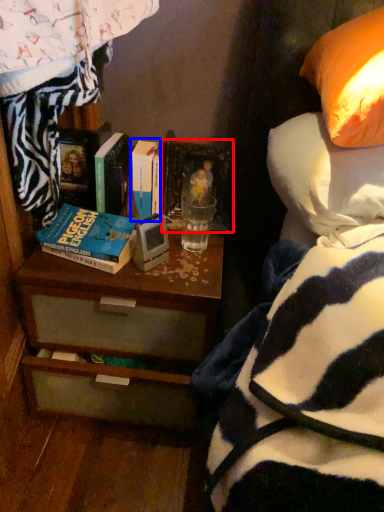
Question: Among these objects, which one is nearest to the camera, picture frame (highlighted by a red box) or book (highlighted by a blue box)?

Choices:
 (A) picture frame
 (B) book

Answer: (B)